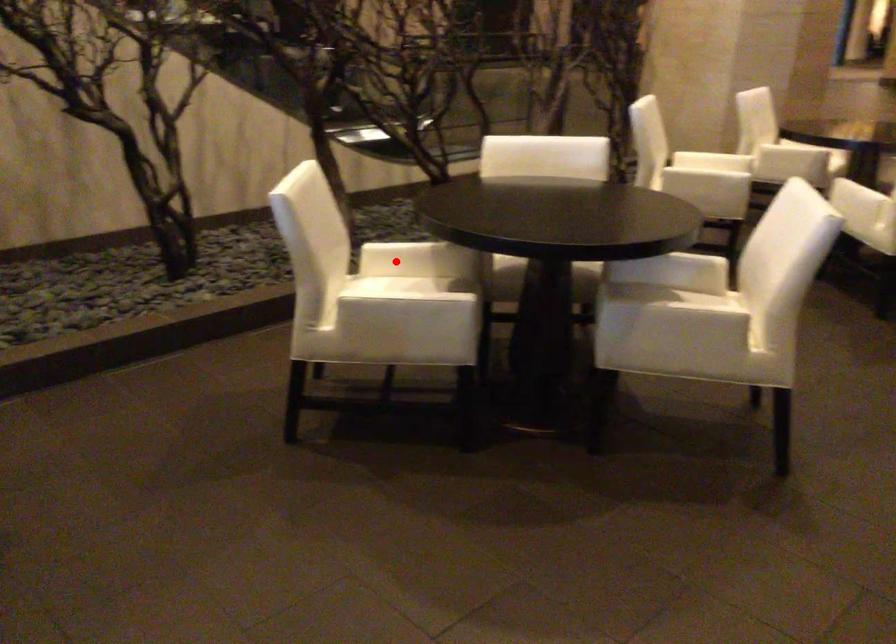
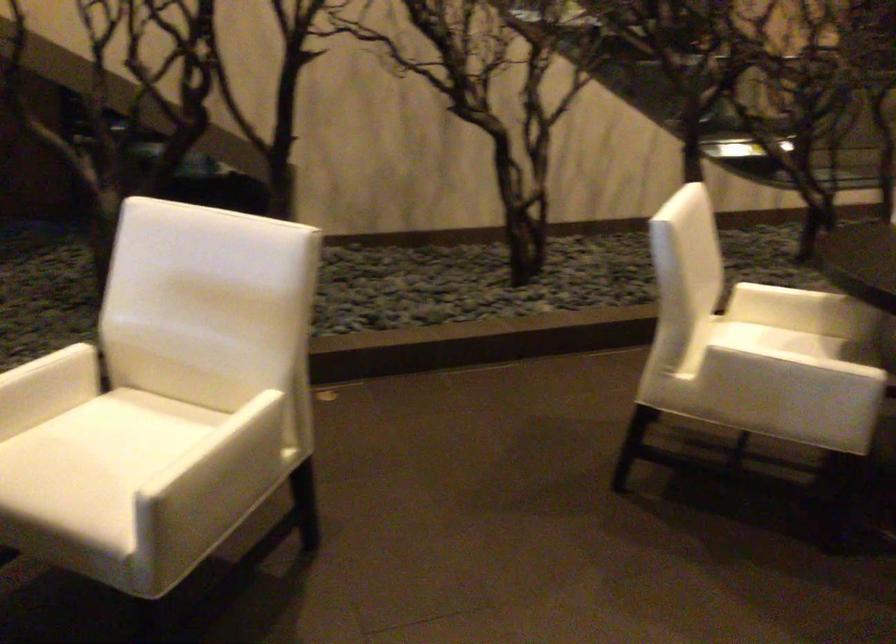
Where in the second image is the point corresponding to the highlighted location from the first image?

(778, 305)